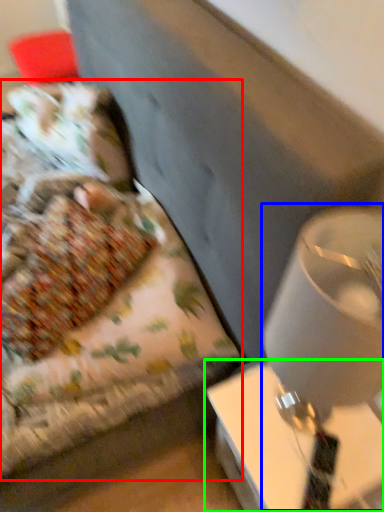
Question: Considering the real-world distances, which object is farthest from bed (highlighted by a red box)? table lamp (highlighted by a blue box) or table (highlighted by a green box)?

Choices:
 (A) table lamp
 (B) table

Answer: (A)